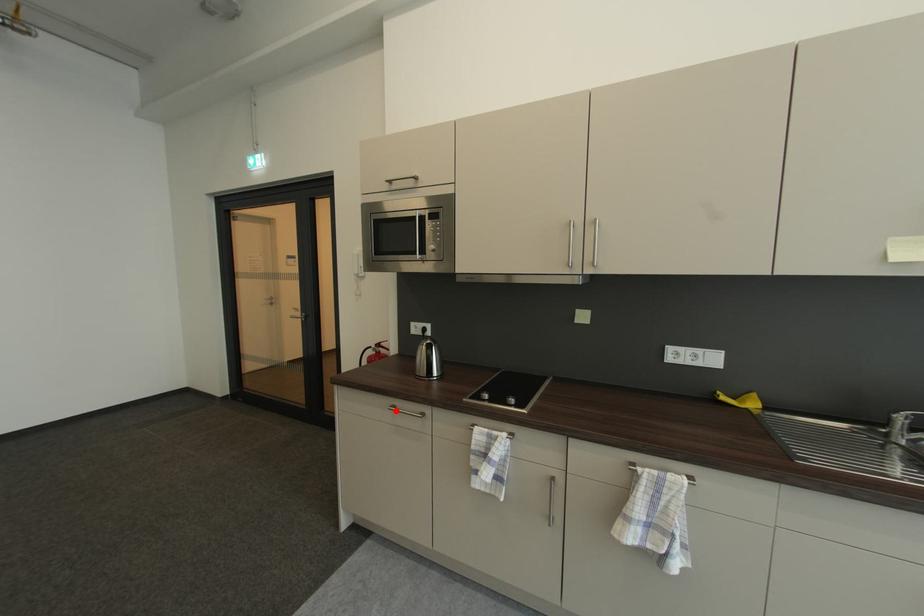
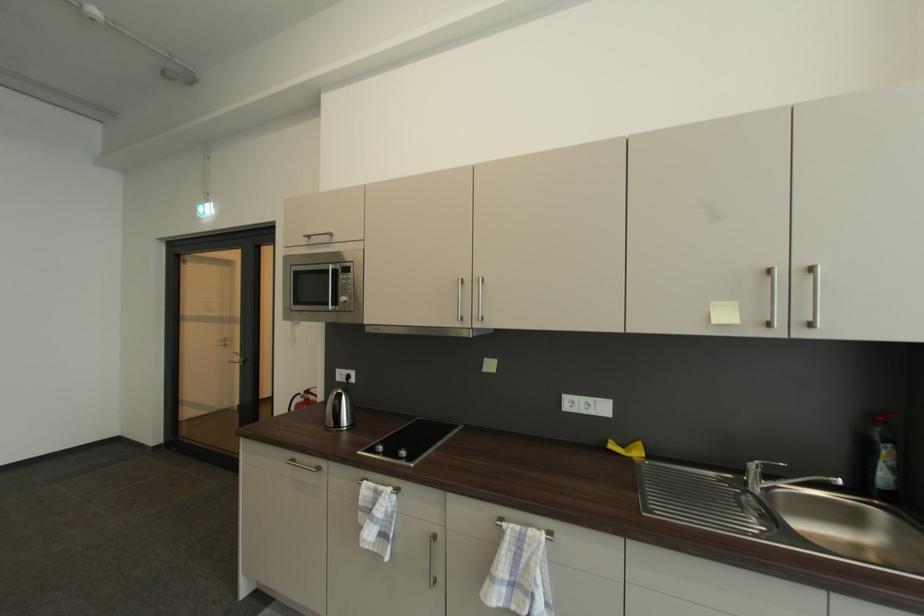
The point at the highlighted location is marked in the first image. Where is the corresponding point in the second image?

(295, 464)